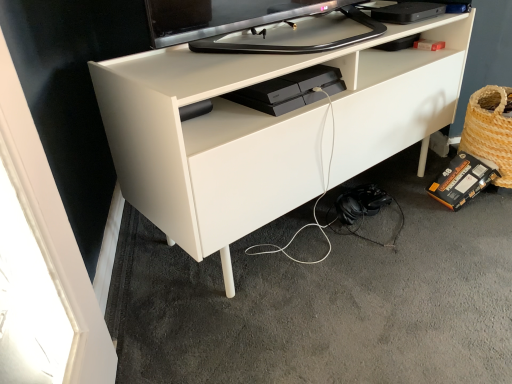
Find the location of a particular element. The image size is (512, 384). free space above black plastic gaming console at center, positioned as the first equipment in top-to-bottom order (from a real-world perspective) is located at coordinates (291, 79).